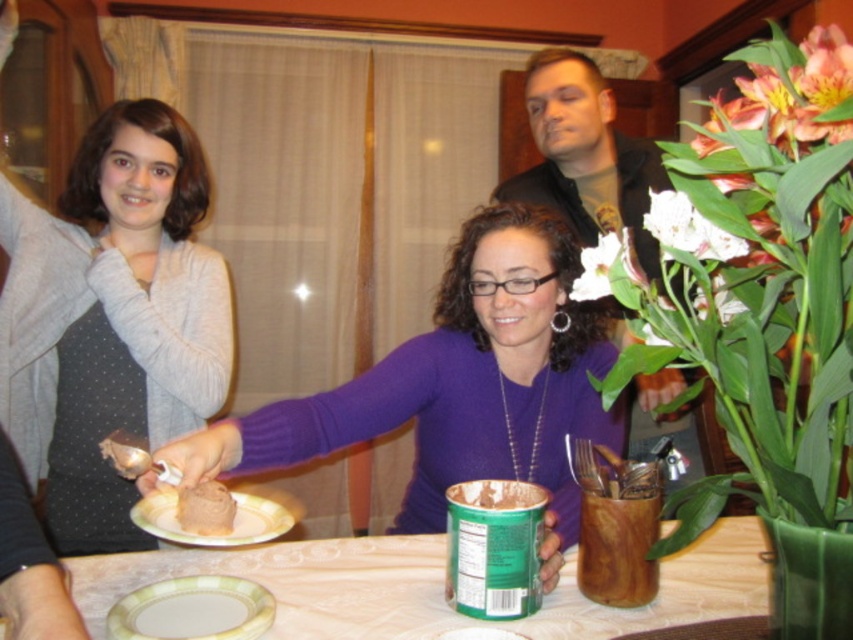
You are at a dinner party and want to place a napkin between the white glossy plate at center and the white matte flower at upper center. The napkin is 10 inches long. Will it reach from one to the other?

The white glossy plate at center is 22.18 inches from the white matte flower at upper center. Since the napkin is only 10 inches long, it will not be long enough to span the distance between them.

You are at the dining table and want to place a spoon on the porcelain plate at lower left. Based on the coordinates provided, where exactly should you place the spoon?

The porcelain plate at lower left is located at point coordinates of (193, 609), so place the spoon at that position.

You are arranging items on a table for a dinner party. You have a porcelain plate at lower left and a white matte flower at upper right. Which item takes up more space on the table?

The white matte flower at upper right takes up more space on the table than the porcelain plate at lower left.